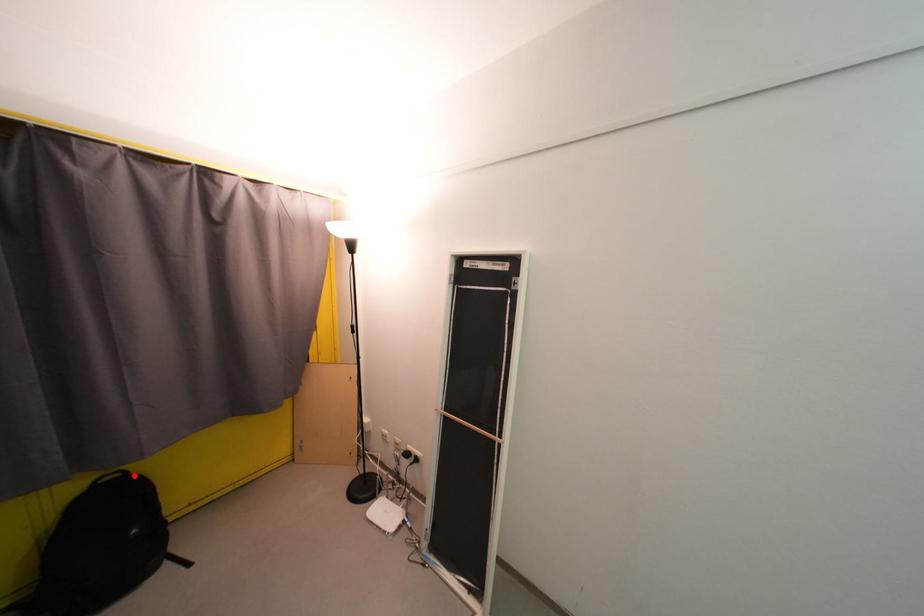
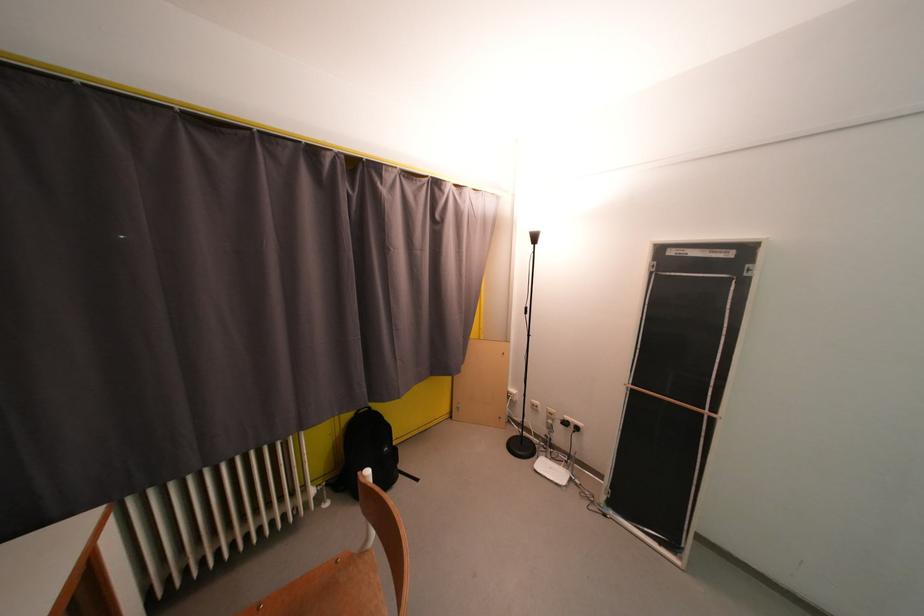
In the second image, find the point that corresponds to the highlighted location in the first image.

(378, 411)